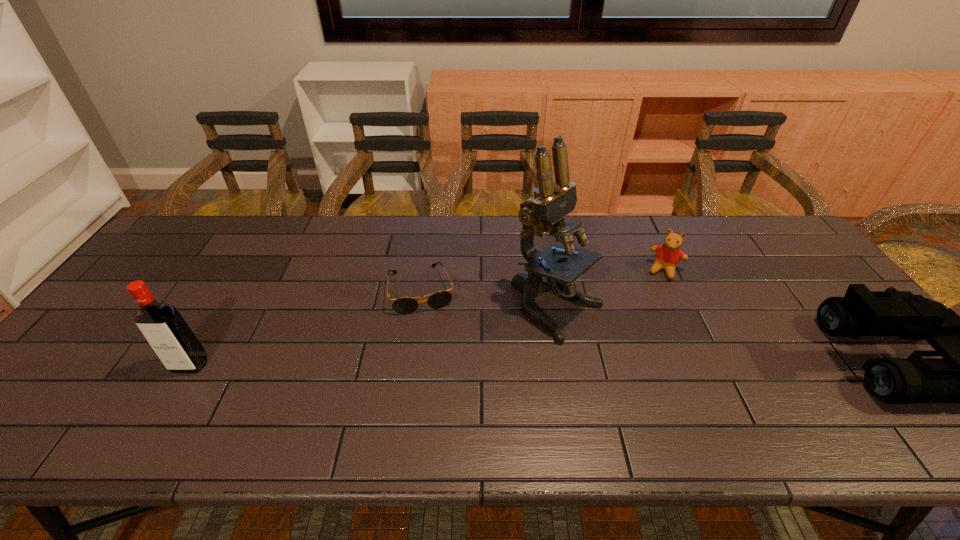
In the image, there is a desktop. Where is `vacant area at the near edge`? The image size is (960, 540). vacant area at the near edge is located at coordinates (408, 391).

You are a GUI agent. You are given a task and a screenshot of the screen. Output one action in this format:
    pyautogui.click(x=<x>, y=<y>)
    Task: Click on the vacant space that's between the microscope and the second object from left to right
    This screenshot has height=540, width=960.
    Given the screenshot: What is the action you would take?
    pyautogui.click(x=490, y=300)

Image resolution: width=960 pixels, height=540 pixels. I want to click on free point between the fourth object from right to left and the leftmost object, so click(305, 327).

You are a GUI agent. You are given a task and a screenshot of the screen. Output one action in this format:
    pyautogui.click(x=<x>, y=<y>)
    Task: Click on the vacant region between the shortest object and the leftmost object
    The width and height of the screenshot is (960, 540).
    Given the screenshot: What is the action you would take?
    pyautogui.click(x=305, y=327)

Locate an element on the screen. Image resolution: width=960 pixels, height=540 pixels. empty location between the tallest object and the teddy bear is located at coordinates (612, 290).

At what (x,y) coordinates should I click in order to perform the action: click on free spot between the sunglasses and the vodka. Please return your answer as a coordinate pair (x, y). Looking at the image, I should click on click(x=305, y=327).

Where is `free spot between the fourth object from left to right and the leftmost object`? The height and width of the screenshot is (540, 960). free spot between the fourth object from left to right and the leftmost object is located at coordinates (427, 318).

Identify which object is located as the second nearest to the shortest object. Please provide its 2D coordinates. Your answer should be formatted as a tuple, i.e. [(x, y)], where the tuple contains the x and y coordinates of a point satisfying the conditions above.

[(171, 338)]

This screenshot has height=540, width=960. Identify the location of the third closest object to the third shortest object. (406, 305).

Locate an element on the screen. vacant area in the image that satisfies the following two spatial constraints: 1. on the front side of the sunglasses; 2. on the left side of the microscope is located at coordinates (419, 310).